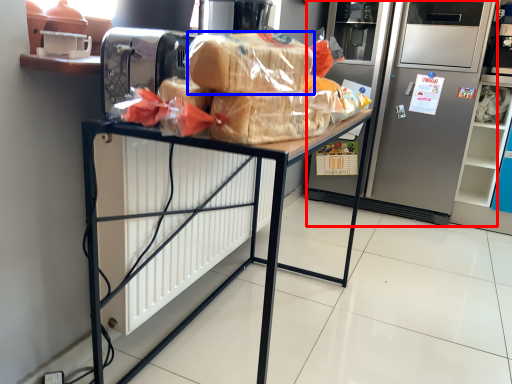
Question: Which object appears farthest to the camera in this image, refrigerator (highlighted by a red box) or bread (highlighted by a blue box)?

Choices:
 (A) refrigerator
 (B) bread

Answer: (A)